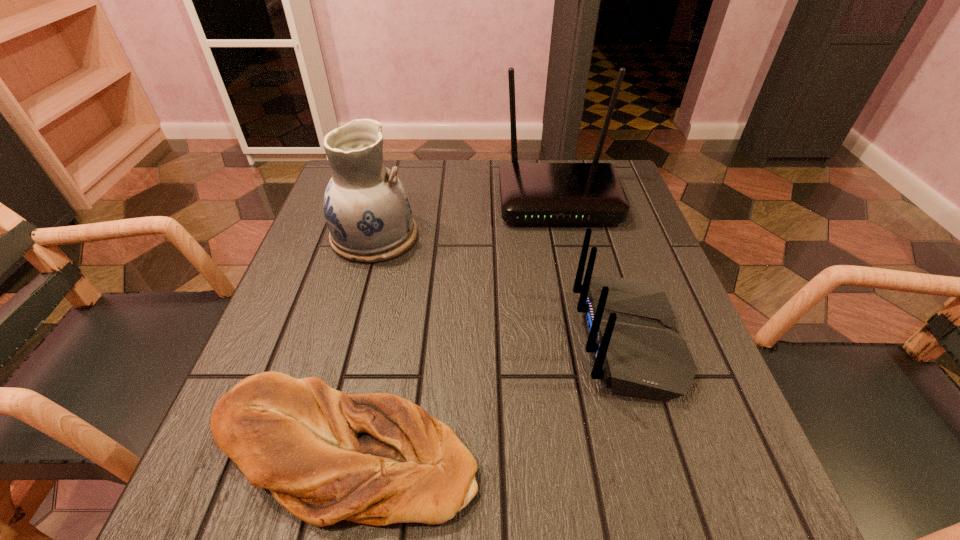
In order to click on free area in between the shortest object and the taller router in this screenshot , I will do `click(451, 326)`.

Identify the location of vacant point located between the farther router and the pottery. The width and height of the screenshot is (960, 540). (467, 218).

The image size is (960, 540). Find the location of `vacant space in between the taller router and the bread`. vacant space in between the taller router and the bread is located at coordinates (451, 326).

Image resolution: width=960 pixels, height=540 pixels. What are the coordinates of `vacant area that lies between the pottery and the shorter router` in the screenshot? It's located at (501, 288).

Locate an element on the screen. The image size is (960, 540). vacant space in between the pottery and the taller router is located at coordinates (467, 218).

Locate an element on the screen. free point between the farther router and the shortest object is located at coordinates (451, 326).

You are a GUI agent. You are given a task and a screenshot of the screen. Output one action in this format:
    pyautogui.click(x=<x>, y=<y>)
    Task: Click on the vacant area between the bread and the taller router
    
    Given the screenshot: What is the action you would take?
    pyautogui.click(x=451, y=326)

Find the location of a particular element. free space between the pottery and the shorter router is located at coordinates (501, 288).

Image resolution: width=960 pixels, height=540 pixels. I want to click on free area in between the pottery and the nearer router, so click(501, 288).

At what (x,y) coordinates should I click in order to perform the action: click on vacant space in between the pottery and the shorter router. Please return your answer as a coordinate pair (x, y). Image resolution: width=960 pixels, height=540 pixels. Looking at the image, I should click on (501, 288).